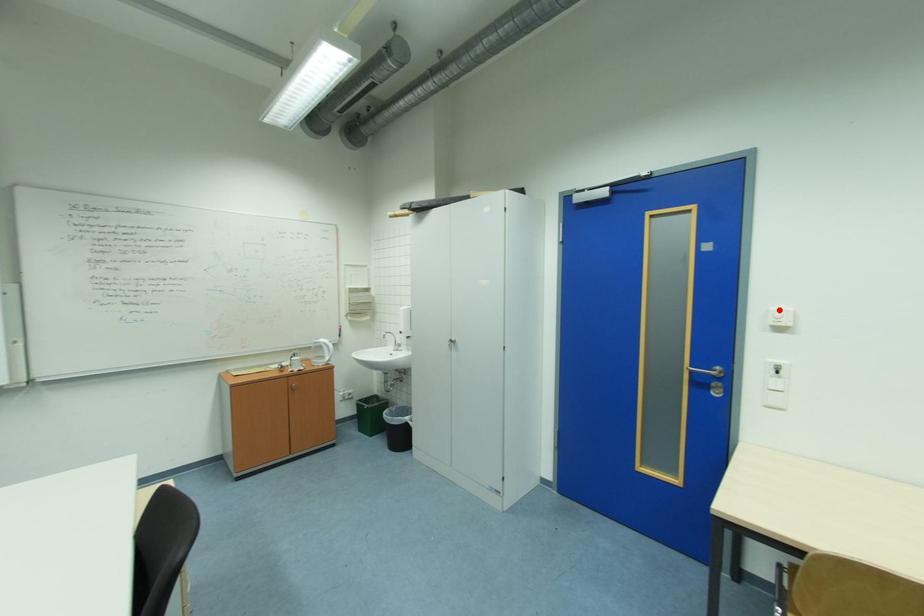
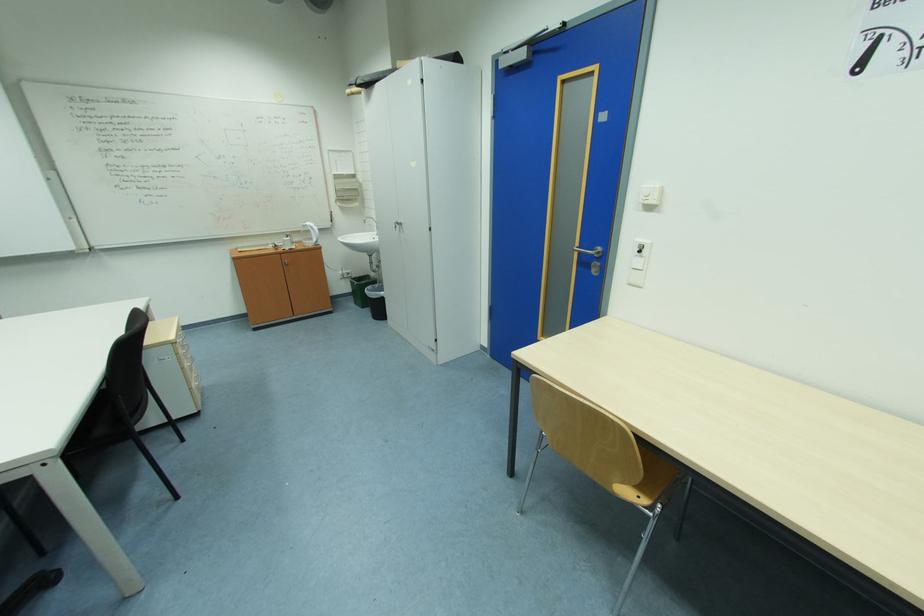
In the second image, find the point that corresponds to the highlighted location in the first image.

(650, 187)